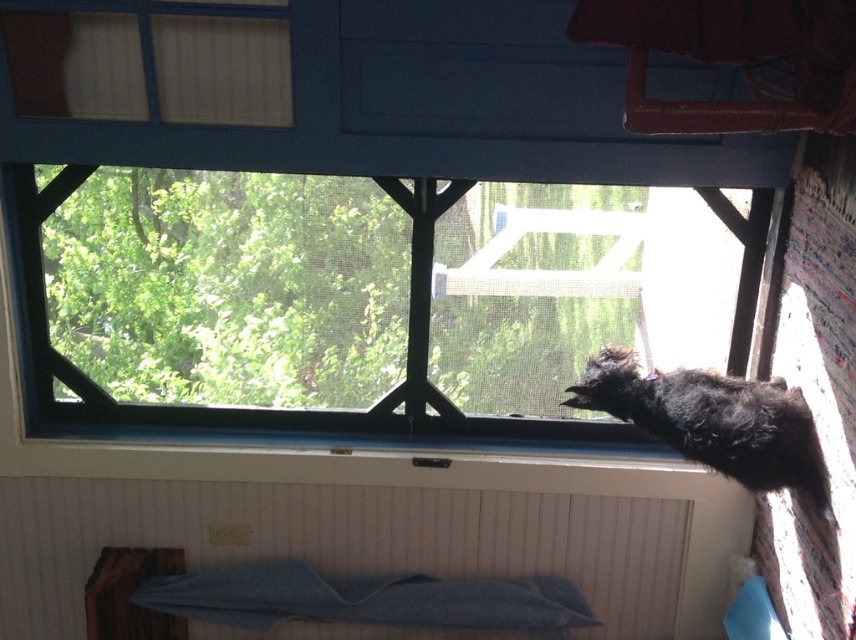
You are an interior designer planning to place a 1.5 meter wide sofa in this room. The sofa must be placed between the clear glass window at center and the blue painted radiator at lower left. Based on the spatial arrangement, will the sofa fit between these two objects?

The clear glass window at center has a lesser width compared to blue painted radiator at lower left. Since the sofa is 1.5 meters wide, and the space between them is narrower than the radiator, it might not fit. However, without exact measurements of the space between them, we can infer that since the window is narrower, the distance between them could be insufficient. Therefore, the sofa may not fit properly between the clear glass window at center and the blue painted radiator at lower left.